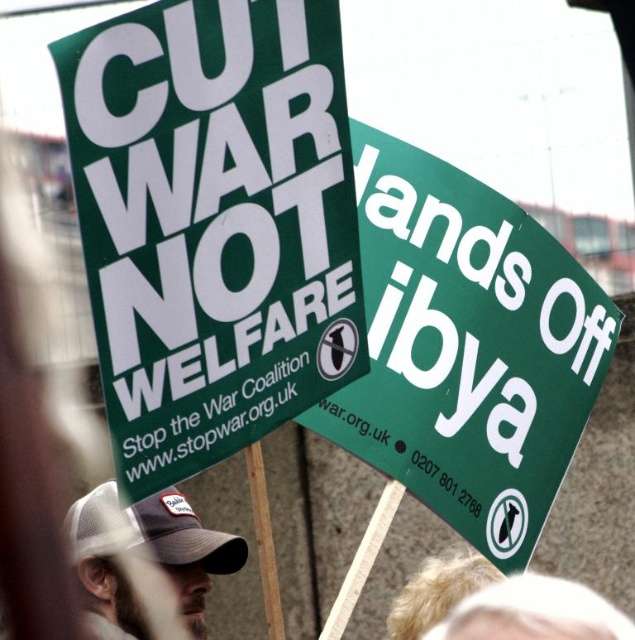
Does green paper sign at upper left have a greater height compared to green paper sign at upper center?

In fact, green paper sign at upper left may be shorter than green paper sign at upper center.

The image size is (635, 640). Find the location of `green paper sign at upper left`. green paper sign at upper left is located at coordinates (211, 224).

Between green paper sign at upper center and white mesh baseball cap at lower left, which one appears on the right side from the viewer's perspective?

Positioned to the right is green paper sign at upper center.

Looking at this image, between green paper sign at upper center and white mesh baseball cap at lower left, which one is positioned lower?

Positioned lower is white mesh baseball cap at lower left.

Locate an element on the screen. Image resolution: width=635 pixels, height=640 pixels. green paper sign at upper center is located at coordinates (465, 348).

Consider the image. Does green paper sign at upper left appear on the right side of white mesh baseball cap at lower left?

Yes, green paper sign at upper left is to the right of white mesh baseball cap at lower left.

Is green paper sign at upper left in front of white mesh baseball cap at lower left?

That is True.

Between point (255, 145) and point (190, 522), which one is positioned in front?

Point (255, 145) is more forward.

Locate an element on the screen. green paper sign at upper left is located at coordinates (211, 224).